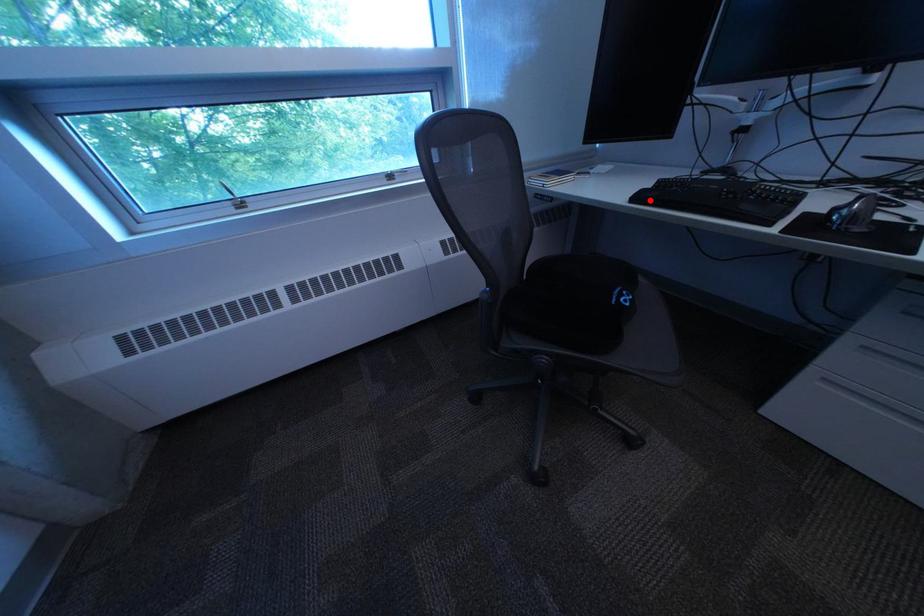
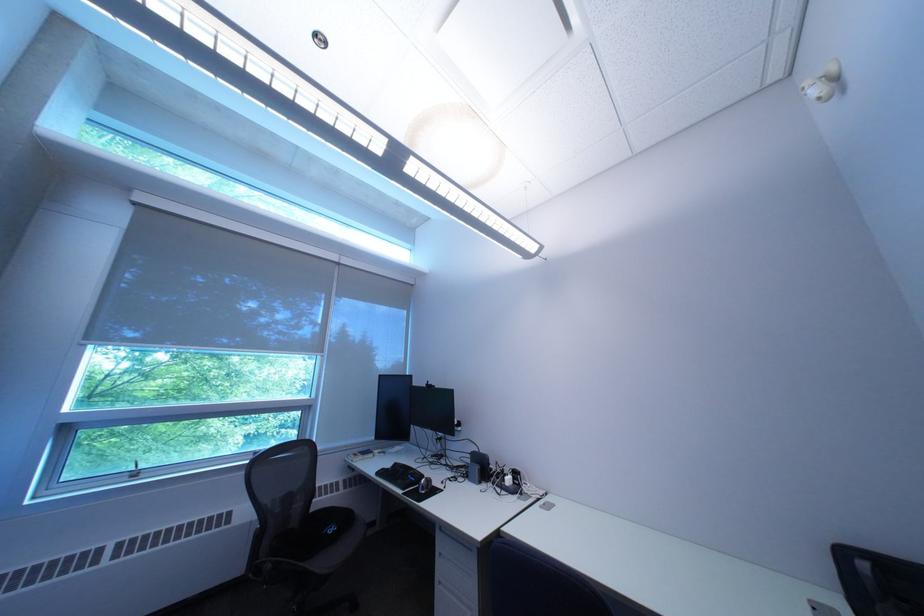
In the second image, find the point that corresponds to the highlighted location in the first image.

(393, 475)